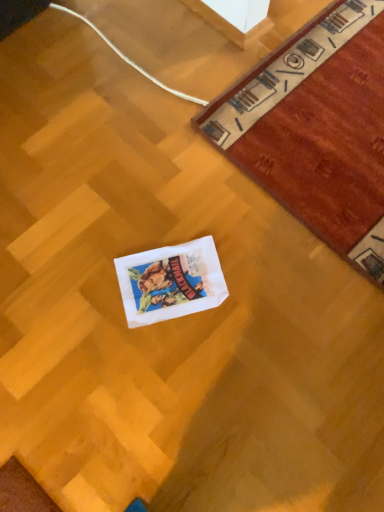
The width and height of the screenshot is (384, 512). I want to click on empty space that is ontop of white paper postcard at center (from a real-world perspective), so click(177, 282).